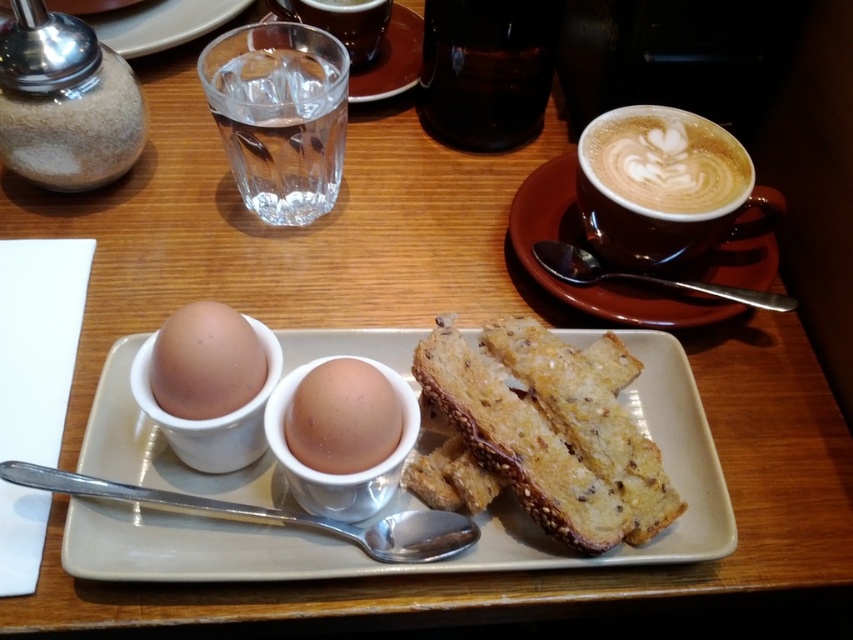
You are a barista preparing a latte. You need to place the latte art foam at upper right into the transparent glass of water at upper left. Is the glass tall enough to hold the foam?

The transparent glass of water at upper left is much taller than latte art foam at upper right, so yes, the glass is tall enough to hold the foam.

You are setting up a breakfast tray and need to place a small decorative bowl between the golden brown toasted bread at center and the brown matte egg at center. The bowl has a diameter of 3 inches. Will there be enough space between them to fit the bowl?

The golden brown toasted bread at center and brown matte egg at center are 3.66 inches apart. Since the bowl has a diameter of 3 inches, there is enough space between them to fit the bowl.

You are a chef preparing a breakfast plate and need to arrange the golden brown toasted bread at center and the brown matte egg at center. Which item should you place first if you want the wider object to occupy more space?

The golden brown toasted bread at center should be placed first because its width is larger than the brown matte egg at center, allowing it to occupy more space on the plate.